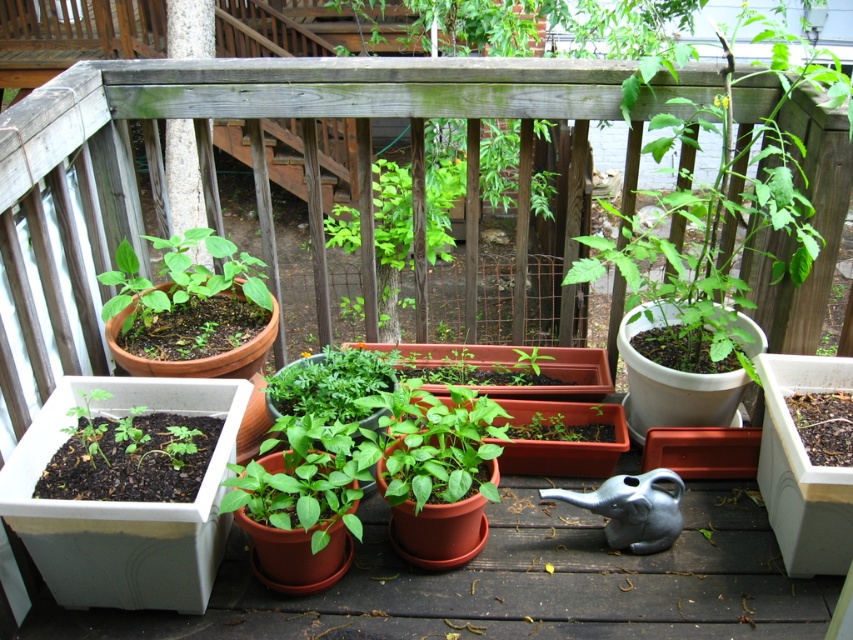
Does green matte plant at center appear under green matte plant at upper left?

No, green matte plant at center is not below green matte plant at upper left.

Image resolution: width=853 pixels, height=640 pixels. Describe the element at coordinates (809, 220) in the screenshot. I see `green matte plant at center` at that location.

Where is `green matte plant at center`? green matte plant at center is located at coordinates (809, 220).